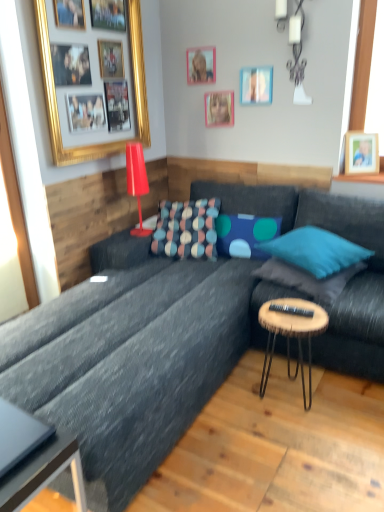
Question: Is matte pink picture frame at upper center, acting as the third picture frame starting from the left, completely or partially inside textured fabric pillow at center, the 4th pillow from the right?

Choices:
 (A) no
 (B) yes

Answer: (A)

Question: Can you confirm if textured fabric pillow at center, positioned as the 1th pillow in left-to-right order, is smaller than matte pink picture frame at upper center, the 3th picture frame from the right?

Choices:
 (A) yes
 (B) no

Answer: (B)

Question: Can you confirm if textured fabric pillow at center, the 4th pillow from the right, is shorter than matte pink picture frame at upper center, the 3th picture frame from the right?

Choices:
 (A) yes
 (B) no

Answer: (B)

Question: Is textured fabric pillow at center, the 4th pillow from the right, closer to camera compared to matte pink picture frame at upper center, acting as the third picture frame starting from the left?

Choices:
 (A) yes
 (B) no

Answer: (A)

Question: Is textured fabric pillow at center, the 4th pillow from the right, positioned beyond the bounds of matte pink picture frame at upper center, acting as the third picture frame starting from the left?

Choices:
 (A) no
 (B) yes

Answer: (B)

Question: Is wooden photo frame at upper right, the 1th picture frame from the right, taller or shorter than gold/gilded picture frame at upper left, the fifth picture frame viewed from the right?

Choices:
 (A) tall
 (B) short

Answer: (B)

Question: Choose the correct answer: Is wooden photo frame at upper right, the 1th picture frame from the right, inside gold/gilded picture frame at upper left, the fifth picture frame viewed from the right, or outside it?

Choices:
 (A) inside
 (B) outside

Answer: (B)

Question: Based on their positions, is wooden photo frame at upper right, the 1th picture frame from the right, located to the left or right of gold/gilded picture frame at upper left, positioned as the 1th picture frame in left-to-right order?

Choices:
 (A) right
 (B) left

Answer: (A)

Question: From the image's perspective, relative to gold/gilded picture frame at upper left, the fifth picture frame viewed from the right, is wooden photo frame at upper right, acting as the 5th picture frame starting from the left, above or below?

Choices:
 (A) below
 (B) above

Answer: (A)

Question: Based on their sizes in the image, would you say white ceramic lamp at upper center, which appears as the 1th lamp when viewed from the top, is bigger or smaller than teal fabric pillow at center, arranged as the first pillow when viewed from the right?

Choices:
 (A) big
 (B) small

Answer: (B)

Question: Considering the positions of white ceramic lamp at upper center, the second lamp positioned from the left, and teal fabric pillow at center, arranged as the first pillow when viewed from the right, in the image, is white ceramic lamp at upper center, the second lamp positioned from the left, taller or shorter than teal fabric pillow at center, arranged as the first pillow when viewed from the right,?

Choices:
 (A) short
 (B) tall

Answer: (B)

Question: Relative to teal fabric pillow at center, arranged as the first pillow when viewed from the right, is white ceramic lamp at upper center, which appears as the 1th lamp when viewed from the top, in front or behind?

Choices:
 (A) behind
 (B) front

Answer: (A)

Question: From a real-world perspective, is white ceramic lamp at upper center, which is the second lamp in bottom-to-top order, positioned above or below teal fabric pillow at center, arranged as the first pillow when viewed from the right?

Choices:
 (A) below
 (B) above

Answer: (B)

Question: In the image, is wooden picture frame at upper center, which is the 2th picture frame from right to left, positioned in front of or behind metallic gray coffee table at lower left?

Choices:
 (A) behind
 (B) front

Answer: (A)

Question: Does point (249, 99) appear closer or farther from the camera than point (23, 416)?

Choices:
 (A) farther
 (B) closer

Answer: (A)